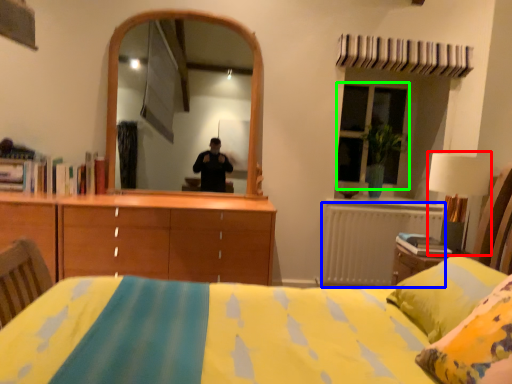
Question: Estimate the real-world distances between objects in this image. Which object is closer to table lamp (highlighted by a red box), radiator (highlighted by a blue box) or window (highlighted by a green box)?

Choices:
 (A) radiator
 (B) window

Answer: (A)